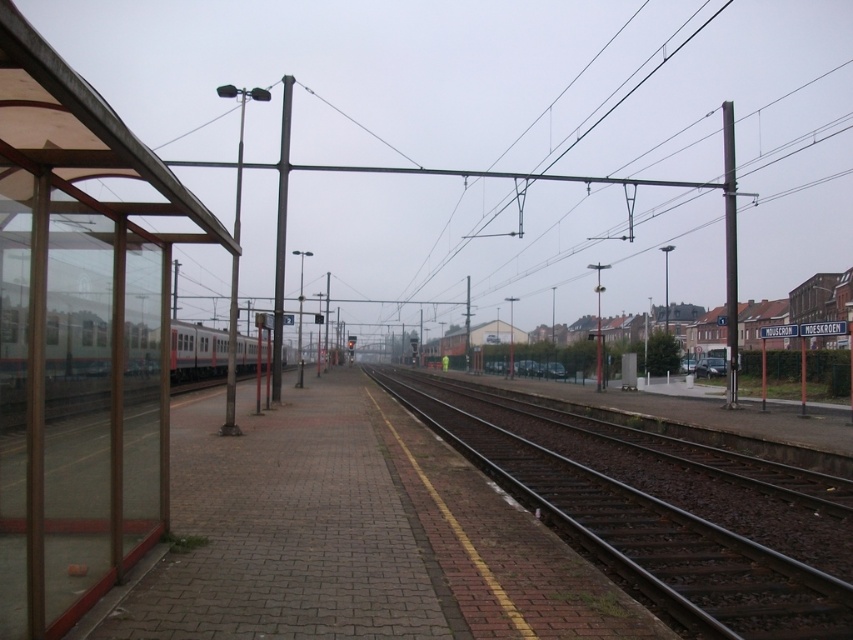
Question: Which point is farther to the camera?

Choices:
 (A) green matte passenger train at left
 (B) metallic pole at left
 (C) metallic pole at right

Answer: (C)

Question: Estimate the real-world distances between objects in this image. Which object is closer to the metallic pole at right?

Choices:
 (A) metal at center
 (B) green matte passenger train at left
 (C) black metal pole at center

Answer: (A)

Question: Is metallic pole at right in front of black metal pole at center?

Choices:
 (A) yes
 (B) no

Answer: (B)

Question: Can you confirm if green matte passenger train at left is wider than black metal pole at center?

Choices:
 (A) yes
 (B) no

Answer: (B)

Question: Does metal at center come behind green matte passenger train at left?

Choices:
 (A) yes
 (B) no

Answer: (A)

Question: Among these points, which one is farthest from the camera?

Choices:
 (A) (277, 268)
 (B) (262, 324)
 (C) (613, 528)
 (D) (730, 272)

Answer: (D)